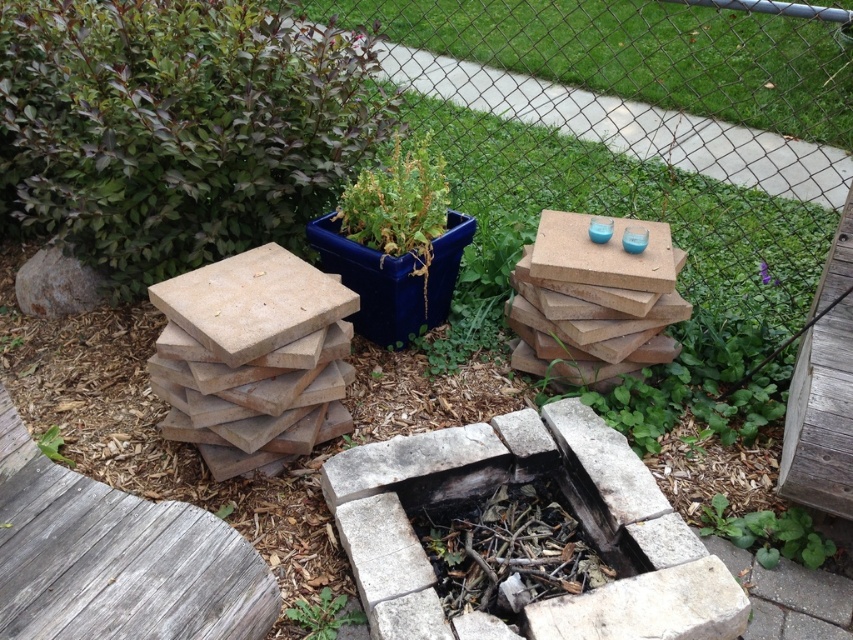
Which is above, green leafy plant at lower right or green leafy plant at lower left?

green leafy plant at lower left

Can you confirm if green leafy plant at lower right is positioned above green leafy plant at lower left?

No.

Between point (780, 518) and point (48, 429), which one is positioned behind?

The point (48, 429) is behind.

Where is `green leafy plant at lower right`? green leafy plant at lower right is located at coordinates (769, 532).

Looking at this image, is blue ceramic planter at center bigger than green leafy plant at lower center?

Correct, blue ceramic planter at center is larger in size than green leafy plant at lower center.

What do you see at coordinates (393, 278) in the screenshot? I see `blue ceramic planter at center` at bounding box center [393, 278].

The width and height of the screenshot is (853, 640). What do you see at coordinates (393, 278) in the screenshot?
I see `blue ceramic planter at center` at bounding box center [393, 278].

You are a GUI agent. You are given a task and a screenshot of the screen. Output one action in this format:
    pyautogui.click(x=<x>, y=<y>)
    Task: Click on the blue ceramic planter at center
    The width and height of the screenshot is (853, 640).
    Given the screenshot: What is the action you would take?
    393,278

Who is positioned more to the right, blue ceramic planter at center or green leafy plant at center?

Positioned to the right is blue ceramic planter at center.

Which is above, blue ceramic planter at center or green leafy plant at center?

blue ceramic planter at center is above.

Is point (440, 236) positioned behind point (219, 512)?

Yes.

The width and height of the screenshot is (853, 640). Find the location of `blue ceramic planter at center`. blue ceramic planter at center is located at coordinates (393, 278).